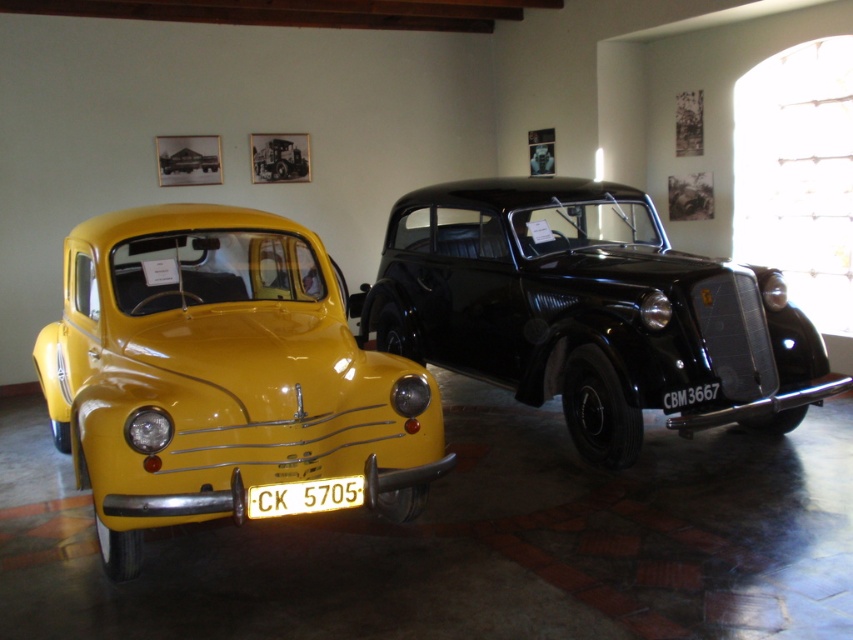
The width and height of the screenshot is (853, 640). Identify the location of matte yellow car at left. (219, 374).

Who is more distant from viewer, (172, 237) or (180, 161)?

Positioned behind is point (180, 161).

The height and width of the screenshot is (640, 853). Identify the location of matte yellow car at left. (219, 374).

Can you confirm if matte yellow car at left is positioned to the right of yellow plastic license plate at center?

No, matte yellow car at left is not to the right of yellow plastic license plate at center.

Who is positioned more to the left, matte yellow car at left or yellow plastic license plate at center?

matte yellow car at left is more to the left.

Does point (271, 305) lie behind point (344, 486)?

Yes.

This screenshot has width=853, height=640. In order to click on matte yellow car at left in this screenshot , I will do `click(219, 374)`.

Is point (360, 420) positioned before point (508, 298)?

Yes, point (360, 420) is closer to viewer.

Which of these two, matte yellow car at left or shiny black car at center, stands taller?

shiny black car at center is taller.

Is point (370, 419) closer to camera compared to point (637, 440)?

Yes, it is in front of point (637, 440).

Identify the location of matte yellow car at left. The height and width of the screenshot is (640, 853). (219, 374).